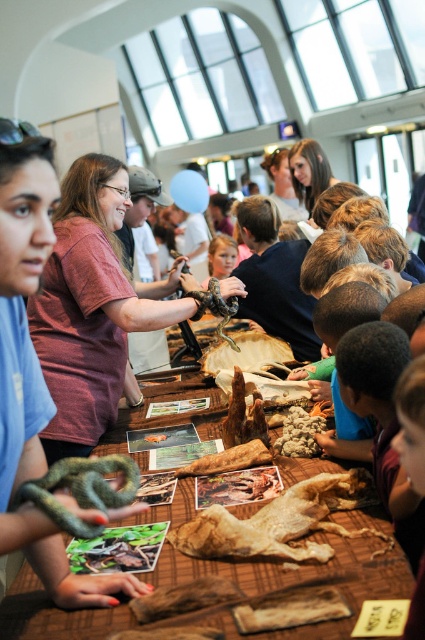
You are standing at the entrance of the educational event area and see two points marked on the floor. The first point is labeled as point (334, 480) and the second point is labeled as point (291, 436). Which point is closer to you?

Point (334, 480) is in front of point (291, 436), so it is closer to you.

You are a participant at the event and want to place both the brown crumbly bread at center and the shiny black snake at center into a box that can only hold items narrower than 10 cm. Based on their widths, can both items fit?

The brown crumbly bread at center has a width less than the shiny black snake at center. Since the box requires items narrower than 10 cm, we need to know the exact widths. However, the description only states the comparison between them. Without specific measurements, we can only confirm that the bread is narrower than the snake, but not if both are under 10 cm. Thus, it is uncertain if both will fit.